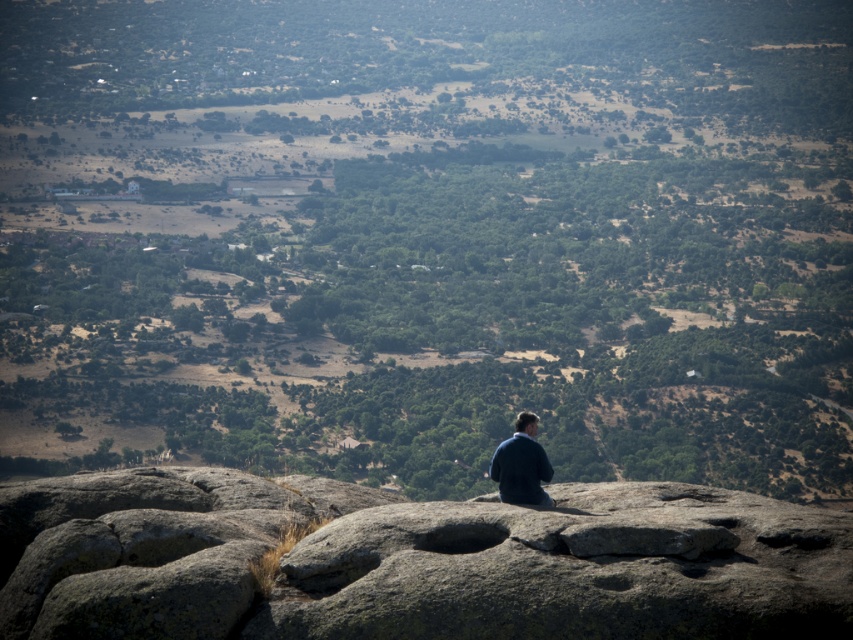
The height and width of the screenshot is (640, 853). What do you see at coordinates (412, 561) in the screenshot? I see `gray rough rock at center` at bounding box center [412, 561].

Is gray rough rock at center to the right of dark blue fabric at center from the viewer's perspective?

In fact, gray rough rock at center is to the left of dark blue fabric at center.

This screenshot has height=640, width=853. I want to click on gray rough rock at center, so click(412, 561).

At what (x,y) coordinates should I click in order to perform the action: click on gray rough rock at center. Please return your answer as a coordinate pair (x, y). Looking at the image, I should click on (412, 561).